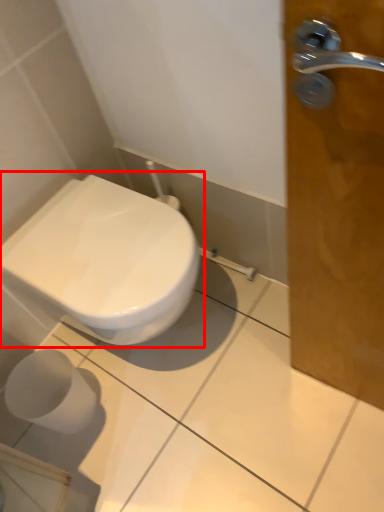
Question: Considering the relative positions of toilet (annotated by the red box) and toilet paper in the image provided, where is toilet (annotated by the red box) located with respect to the staircase?

Choices:
 (A) right
 (B) left

Answer: (A)